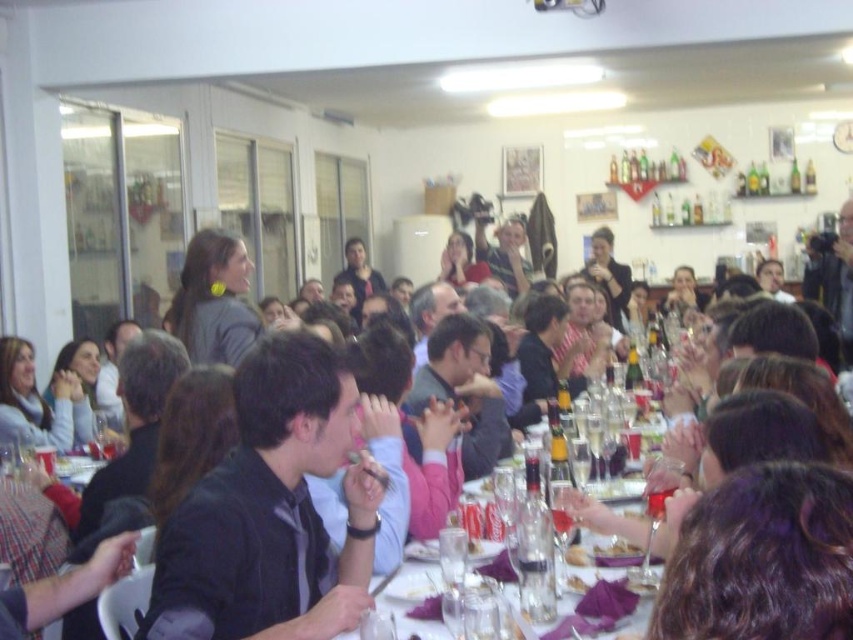
Question: Which of the following is the closest to the observer?

Choices:
 (A) translucent glass wine at center
 (B) matte gray jacket at upper center
 (C) smooth purple plate at center

Answer: (B)

Question: From the image, what is the correct spatial relationship of clear glass table at center in relation to smooth purple plate at center?

Choices:
 (A) below
 (B) above

Answer: (B)

Question: Estimate the real-world distances between objects in this image. Which object is farther from the matte gray jacket at upper center?

Choices:
 (A) dark gray shirt at center
 (B) smooth purple plate at center
 (C) clear glass table at center

Answer: (A)

Question: Does matte gray jacket at upper center appear on the right side of smooth purple plate at center?

Choices:
 (A) no
 (B) yes

Answer: (B)

Question: Can you confirm if clear glass table at center is positioned to the right of translucent glass wine at center?

Choices:
 (A) yes
 (B) no

Answer: (A)

Question: Which point appears closest to the camera in this image?

Choices:
 (A) (578, 515)
 (B) (293, 545)

Answer: (B)